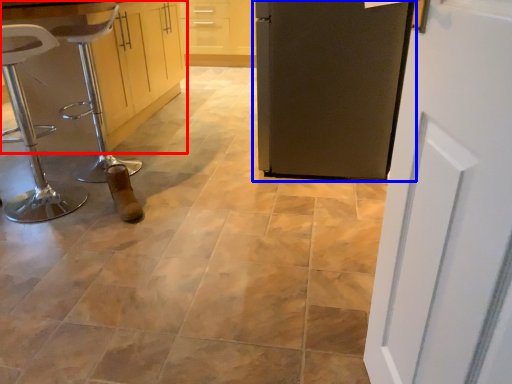
Question: Which object is closer to the camera taking this photo, cabinetry (highlighted by a red box) or door (highlighted by a blue box)?

Choices:
 (A) cabinetry
 (B) door

Answer: (B)